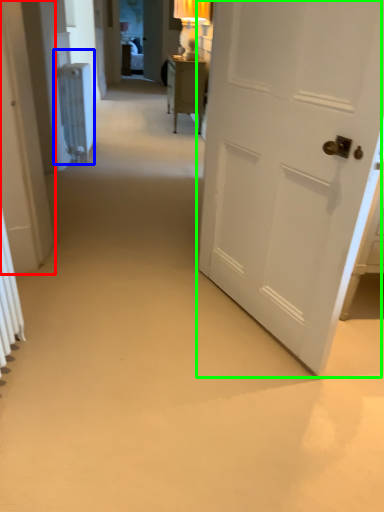
Question: Based on their relative distances, which object is nearer to door (highlighted by a red box)? Choose from radiator (highlighted by a blue box) and door (highlighted by a green box).

Choices:
 (A) radiator
 (B) door

Answer: (B)